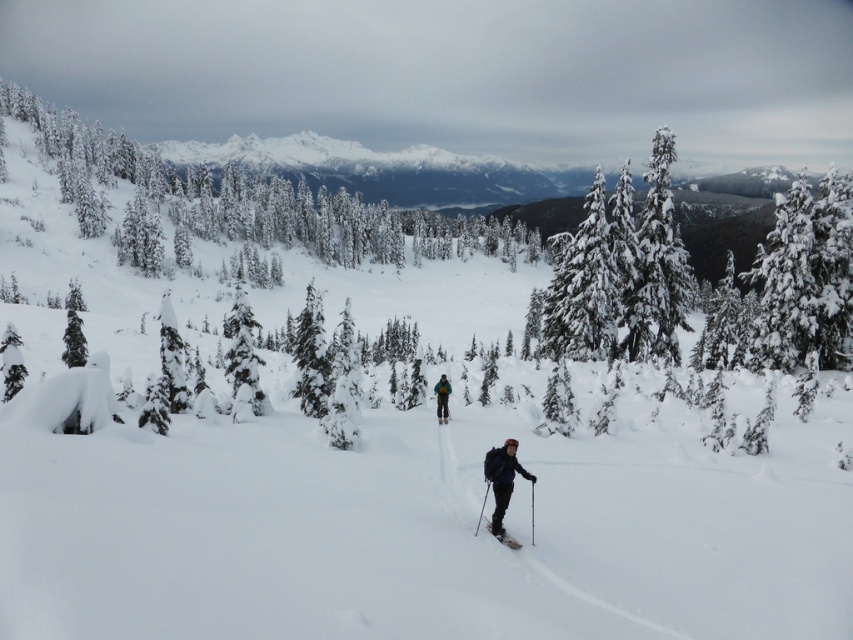
Question: Can you confirm if snow-covered evergreen at center is wider than snow-covered evergreen tree at center?

Choices:
 (A) yes
 (B) no

Answer: (B)

Question: Which object is farther from the camera taking this photo?

Choices:
 (A) green fabric jacket at center
 (B) green textured tree at upper right
 (C) snow-covered evergreen at center
 (D) dark blue jacket at center

Answer: (B)

Question: Does green textured tree at upper right appear under shiny black ski at lower center?

Choices:
 (A) no
 (B) yes

Answer: (A)

Question: Is green textured tree at upper right positioned at the back of matte black ski at center?

Choices:
 (A) no
 (B) yes

Answer: (B)

Question: Estimate the real-world distances between objects in this image. Which object is farther from the green fabric jacket at center?

Choices:
 (A) snow-covered evergreen tree at center
 (B) green textured tree at upper right

Answer: (B)

Question: Which of the following is the farthest from the observer?

Choices:
 (A) green fabric jacket at center
 (B) matte black ski at center
 (C) green textured tree at upper right

Answer: (C)